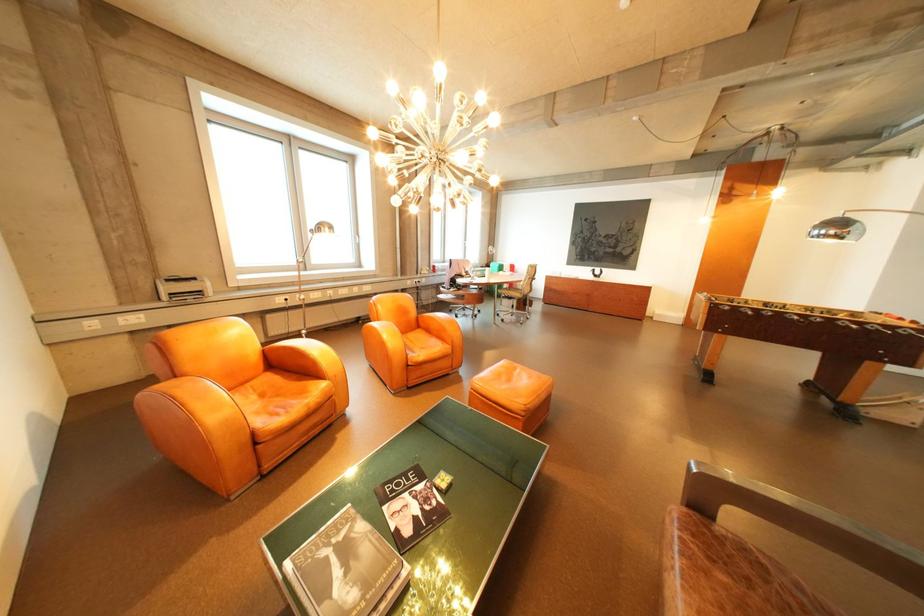
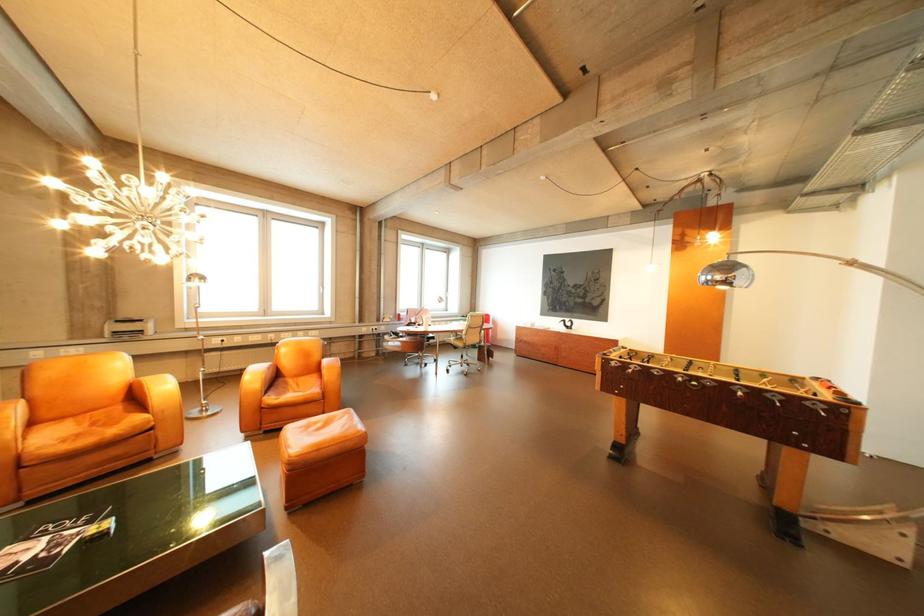
The point at (275,395) is marked in the first image. Where is the corresponding point in the second image?

(107, 424)